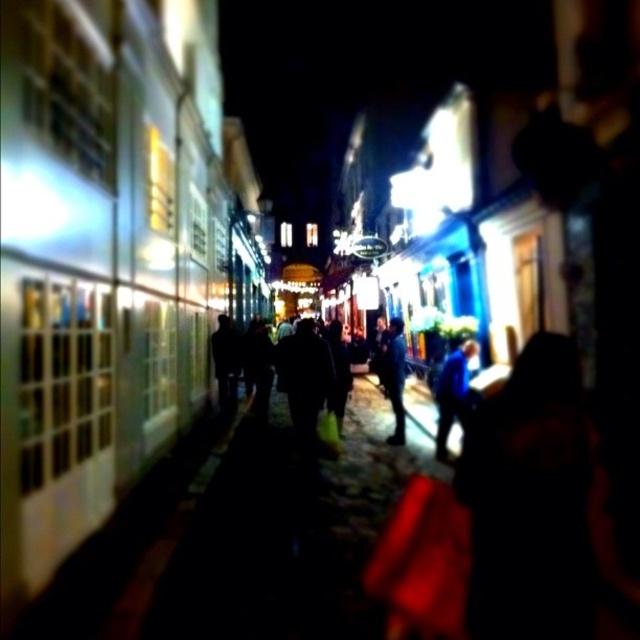
You are a street vendor trying to set up a small cart between the blue fabric jacket at center and the dark blue jacket at center. The cart requires 1 meter of space. Can you fit it between them?

The blue fabric jacket at center might be wider than dark blue jacket at center, but without exact measurements, it is uncertain if the space between them is sufficient for the 1 meter cart. Check the actual distance before deciding.

You are a pedestrian standing at the point marked by the coordinates point (452, 394) in the image. Looking around, you see a blue fabric jacket at center. What is the nearest object to you in this scene?

The nearest object to you is the blue fabric jacket at center, as you are standing at the coordinates corresponding to its location.